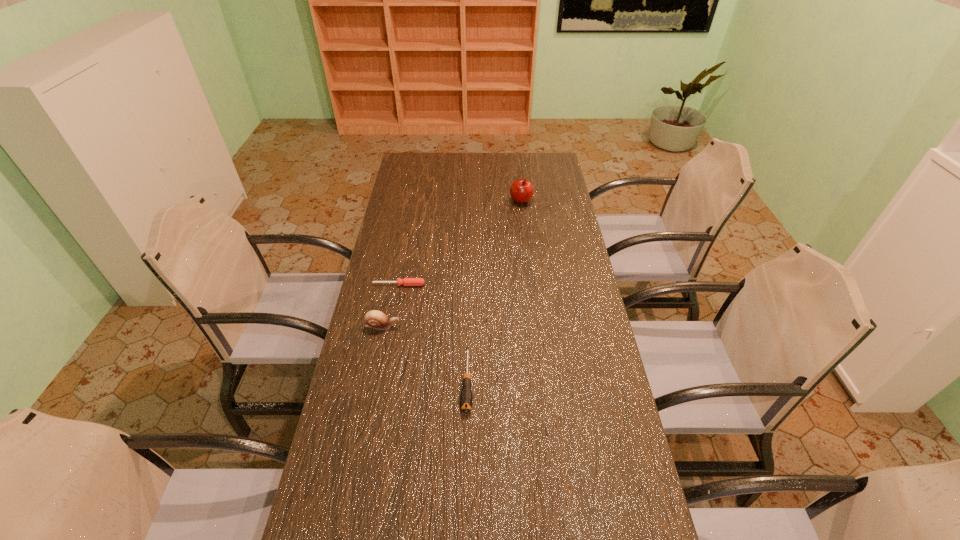
I want to click on object that is the closest to the farther screwdriver, so click(375, 319).

Locate which object is the closest to the second tallest object. Please provide its 2D coordinates. Your answer should be formatted as a tuple, i.e. [(x, y)], where the tuple contains the x and y coordinates of a point satisfying the conditions above.

[(406, 281)]

I want to click on vacant space that satisfies the following two spatial constraints: 1. on the back side of the nearest object; 2. on the front-facing side of the second nearest object, so click(468, 326).

The width and height of the screenshot is (960, 540). Identify the location of vacant space that satisfies the following two spatial constraints: 1. on the front side of the rightmost object; 2. on the front-facing side of the second nearest object. (536, 326).